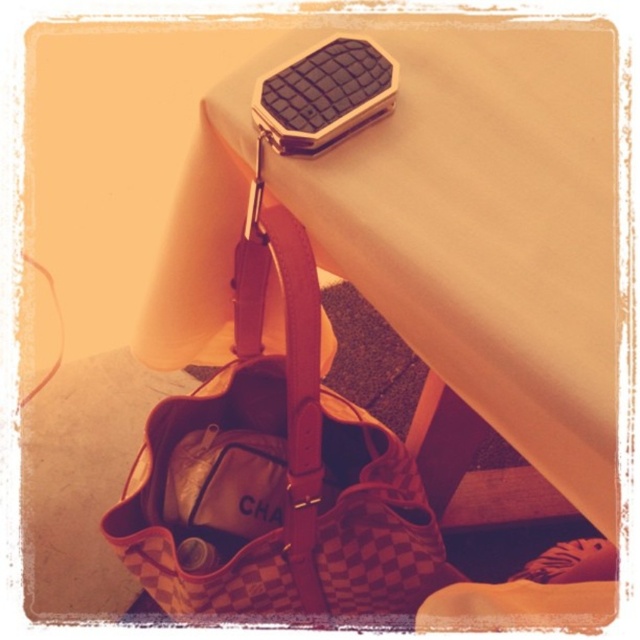
Does point (490, 202) lie behind point (563, 579)?

No, it is in front of (563, 579).

Who is positioned more to the left, black textured box at upper center or leather at lower right?

black textured box at upper center

Image resolution: width=640 pixels, height=640 pixels. In order to click on black textured box at upper center in this screenshot , I will do `click(490, 232)`.

What do you see at coordinates (280, 476) in the screenshot?
I see `checkerboard fabric handbag at center` at bounding box center [280, 476].

Locate an element on the screen. The image size is (640, 640). checkerboard fabric handbag at center is located at coordinates (280, 476).

Does leather strap at upper center lie behind leather at lower right?

No, it is not.

Between leather strap at upper center and leather at lower right, which one is positioned higher?

leather strap at upper center is above.

What do you see at coordinates (300, 401) in the screenshot? I see `leather strap at upper center` at bounding box center [300, 401].

Find the location of a particular element. leather strap at upper center is located at coordinates (300, 401).